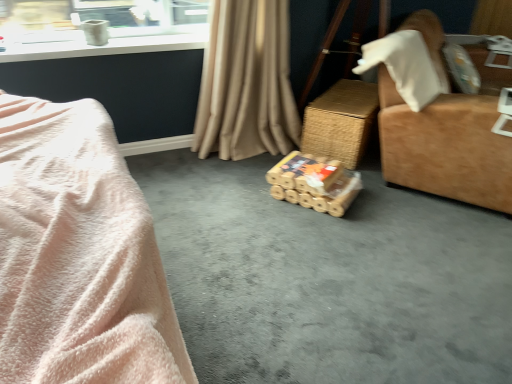
Locate an element on the screen. vacant area on top of brown cardboard boxes at center (from a real-world perspective) is located at coordinates (275, 247).